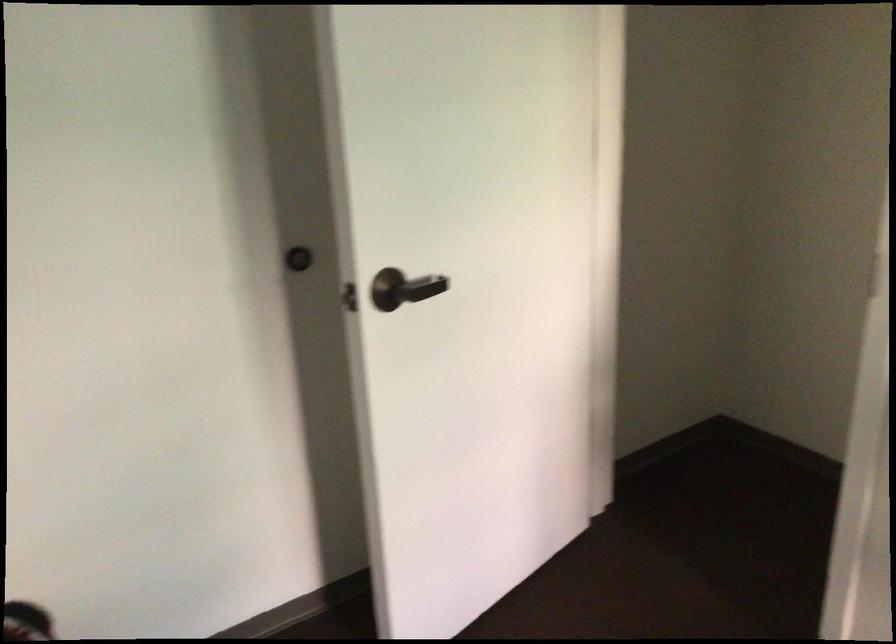
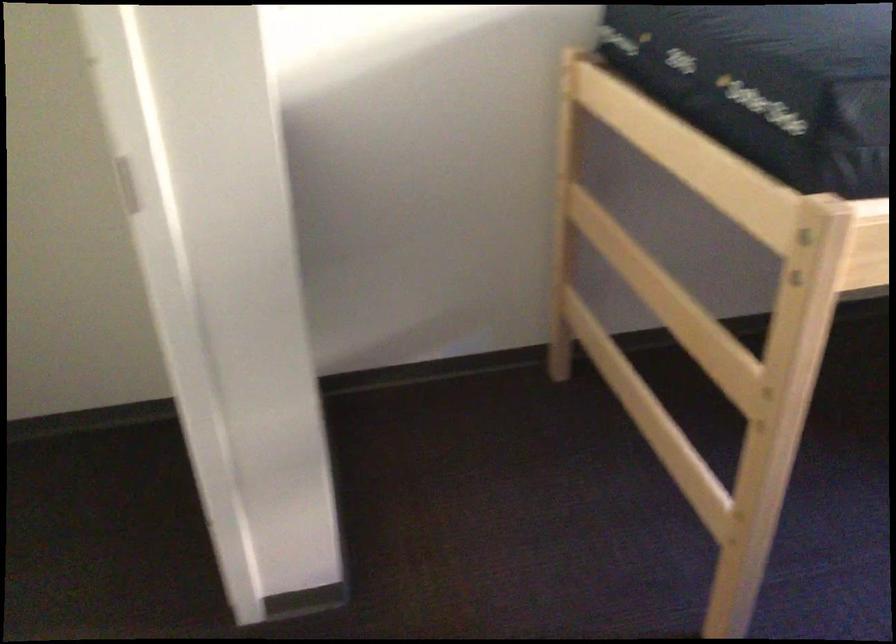
The first image is from the beginning of the video and the second image is from the end. How did the camera likely rotate when shooting the video?

The camera rotated toward right-down.